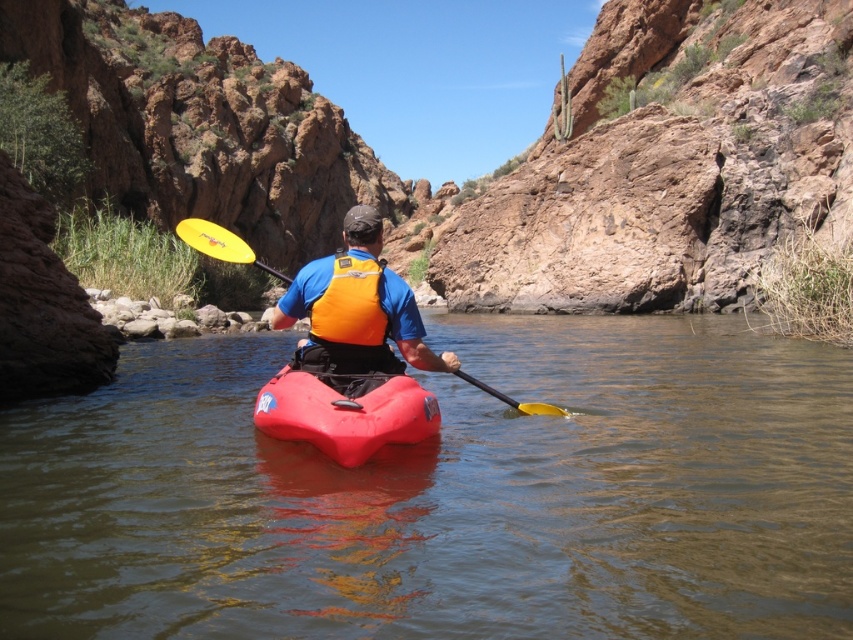
Is point (612, 561) closer to viewer compared to point (361, 284)?

Yes, it is in front of point (361, 284).

What do you see at coordinates (445, 493) in the screenshot? This screenshot has width=853, height=640. I see `smooth plastic kayak at center` at bounding box center [445, 493].

What are the coordinates of `smooth plastic kayak at center` in the screenshot? It's located at (445, 493).

Between point (676, 564) and point (221, 241), which one is positioned in front?

Point (676, 564)

Can you confirm if smooth plastic kayak at center is taller than yellow plastic paddle at center?

Incorrect, smooth plastic kayak at center's height is not larger of yellow plastic paddle at center's.

Is point (625, 616) behind point (212, 224)?

No, it is not.

Find the location of `smooth plastic kayak at center`. smooth plastic kayak at center is located at coordinates (445, 493).

Does smooth plastic kayak at center appear on the left side of matte orange life vest at center?

No, smooth plastic kayak at center is not to the left of matte orange life vest at center.

Consider the image. Which of these two, smooth plastic kayak at center or matte orange life vest at center, stands taller?

With more height is smooth plastic kayak at center.

Between point (712, 326) and point (363, 365), which one is positioned behind?

Positioned behind is point (712, 326).

At what (x,y) coordinates should I click in order to perform the action: click on smooth plastic kayak at center. Please return your answer as a coordinate pair (x, y). Looking at the image, I should click on (445, 493).